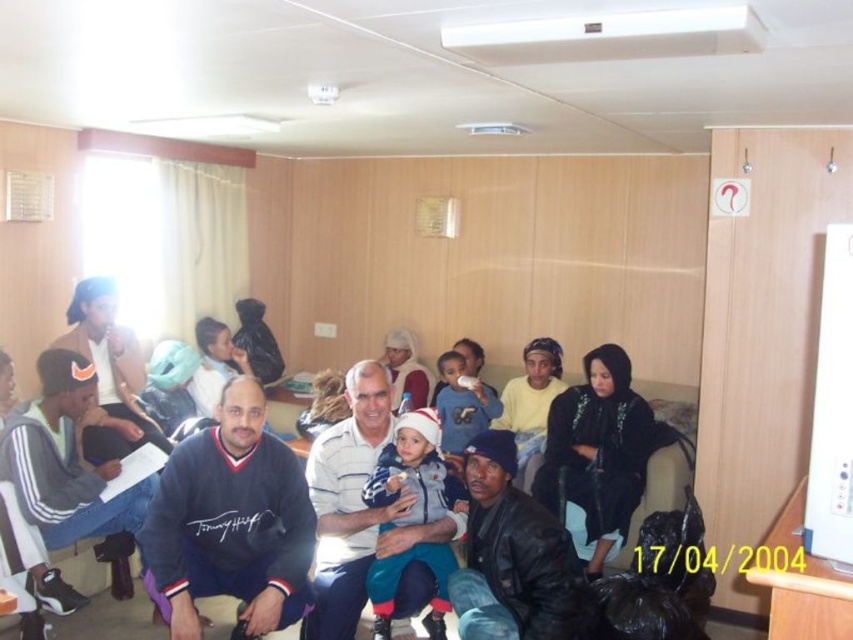
Who is lower down, dark blue sweater at center or blue cotton shirt at center?

blue cotton shirt at center

This screenshot has width=853, height=640. Find the location of `dark blue sweater at center`. dark blue sweater at center is located at coordinates (532, 403).

Consider the image. Who is positioned more to the right, dark blue sweater at lower left or dark blue sweater at center?

dark blue sweater at center is more to the right.

Is dark blue sweater at lower left below dark blue sweater at center?

Yes, dark blue sweater at lower left is below dark blue sweater at center.

Is point (178, 477) in front of point (532, 476)?

That is True.

The image size is (853, 640). Find the location of `dark blue sweater at lower left`. dark blue sweater at lower left is located at coordinates (230, 522).

Which is behind, point (366, 406) or point (433, 544)?

The point (366, 406) is more distant.

Is point (364, 477) farther from viewer compared to point (431, 420)?

That is True.

This screenshot has width=853, height=640. Find the location of `white cotton shirt at center`. white cotton shirt at center is located at coordinates (347, 502).